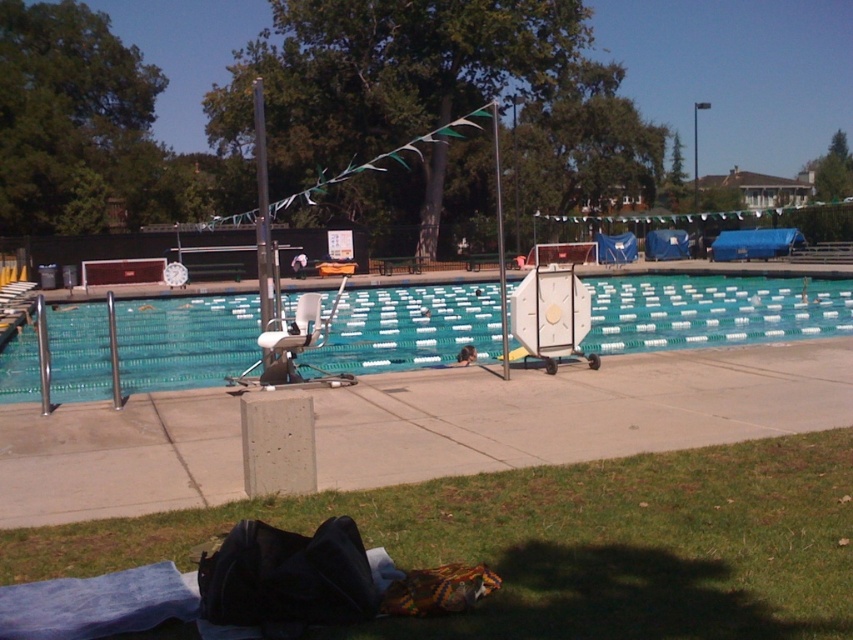
Is point (258, 120) positioned after point (505, 323)?

No, it is in front of (505, 323).

Is the position of silver metallic pole at center less distant than that of metallic pole at center?

Yes, it is in front of metallic pole at center.

Is point (257, 211) farther from camera compared to point (498, 204)?

That is False.

Where is `silver metallic pole at center`? silver metallic pole at center is located at coordinates (262, 209).

Does teal plastic pool at center have a smaller size compared to metallic pole at center?

Actually, teal plastic pool at center might be larger than metallic pole at center.

Which is in front, point (83, 387) or point (502, 298)?

Point (83, 387)

Between point (485, 323) and point (502, 328), which one is positioned in front?

Point (502, 328) is in front.

Identify the location of teal plastic pool at center. The image size is (853, 640). (711, 310).

Is green grass at lower center wider than metallic pole at center?

Indeed, green grass at lower center has a greater width compared to metallic pole at center.

Is point (641, 502) closer to camera compared to point (500, 253)?

That is True.

Between point (21, 561) and point (505, 372), which one is positioned behind?

The point (505, 372) is behind.

Image resolution: width=853 pixels, height=640 pixels. Find the location of `green grass at lower center`. green grass at lower center is located at coordinates tap(563, 544).